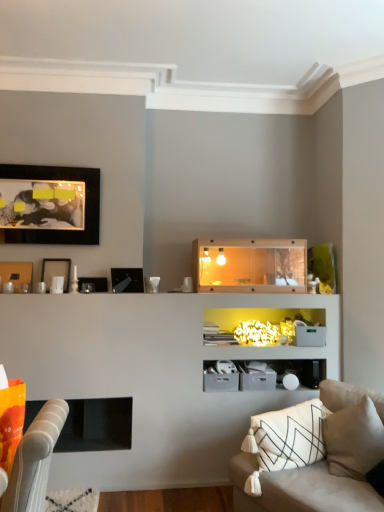
Question: Considering the positions of white matte picture frame at upper left, the 3th picture frame in the bottom-to-top sequence, and matte black picture frame at upper left, positioned as the fourth picture frame in top-to-bottom order, in the image, is white matte picture frame at upper left, the 3th picture frame in the bottom-to-top sequence, bigger or smaller than matte black picture frame at upper left, positioned as the fourth picture frame in top-to-bottom order,?

Choices:
 (A) small
 (B) big

Answer: (B)

Question: In terms of height, does white matte picture frame at upper left, which is the second picture frame from top to bottom, look taller or shorter compared to matte black picture frame at upper left, the first picture frame positioned from the bottom?

Choices:
 (A) tall
 (B) short

Answer: (A)

Question: Based on their relative distances, which object is nearer to the matte black picture frame at upper left, the first picture frame positioned from the bottom?

Choices:
 (A) black matte fireplace at lower left
 (B) white matte picture frame at upper left, the 3th picture frame in the bottom-to-top sequence
 (C) white soft pillow at lower right
 (D) matte black picture frame at upper left, the fourth picture frame from the bottom
 (E) wooden shelf at center

Answer: (B)

Question: Which is nearer to the wooden shelf at center?

Choices:
 (A) white soft pillow at lower right
 (B) matte black picture frame at upper left, arranged as the 1th picture frame when viewed from the top
 (C) matte black picture frame at upper left, the first picture frame positioned from the bottom
 (D) black matte fireplace at lower left
 (E) beige fabric couch at lower right

Answer: (C)